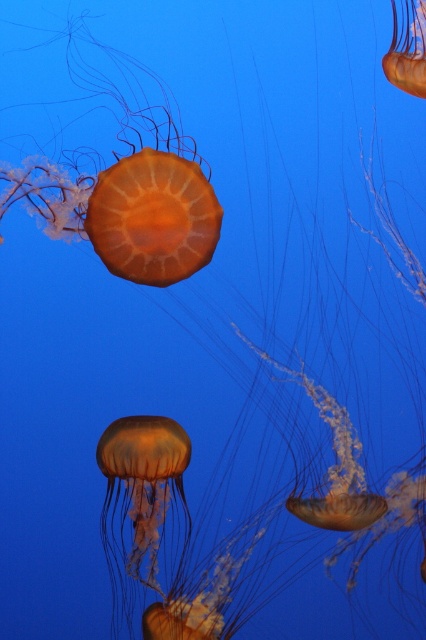
You are a scuba diver swimming in the underwater scene. You notice two points marked in the image. Which point is closer to you, point 1 at coordinates point 1 at coordinates point (129, 525) or point 2 at coordinates point (393, 81)?

Point 1 at coordinates point (129, 525) is closer to you because it is further to the viewer than point 2 at coordinates point (393, 81).

Please imagine you are an underwater photographer. You want to take a photo of the translucent orange jellyfish at center. According to the coordinates provided, where should you position your camera to capture the jellyfish in the center of the photo?

The translucent orange jellyfish at center is located at coordinates point (141, 500), so you should position your camera to aim at that point to capture it in the center of the photo.